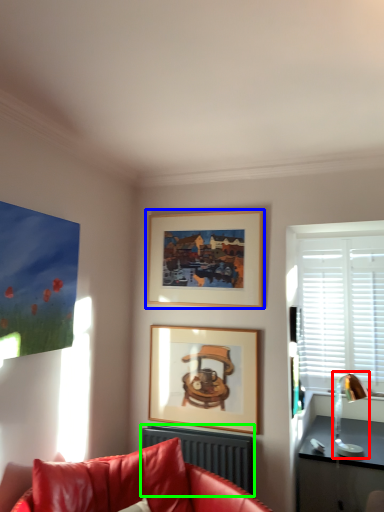
Question: Estimate the real-world distances between objects in this image. Which object is farther from lamp (highlighted by a red box), picture frame (highlighted by a blue box) or radiator (highlighted by a green box)?

Choices:
 (A) picture frame
 (B) radiator

Answer: (A)